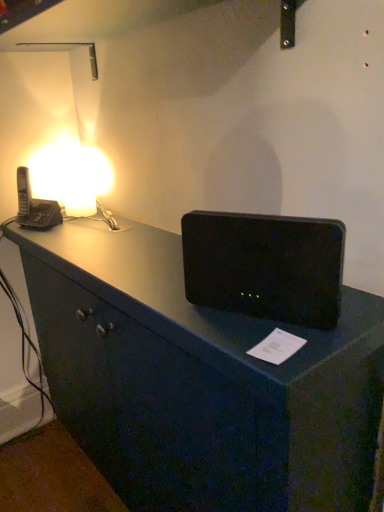
What do you see at coordinates (35, 206) in the screenshot?
I see `black plastic phone at left` at bounding box center [35, 206].

Where is `black plastic speaker at center`? The width and height of the screenshot is (384, 512). black plastic speaker at center is located at coordinates (265, 266).

What do you see at coordinates (265, 266) in the screenshot? The image size is (384, 512). I see `black plastic speaker at center` at bounding box center [265, 266].

What is the approximate width of matte white lamp at upper left?

The width of matte white lamp at upper left is 10.88 centimeters.

Locate an element on the screen. This screenshot has width=384, height=512. black plastic phone at left is located at coordinates (35, 206).

Which is more distant, (42, 200) or (340, 290)?

The point (42, 200) is farther.

Between black plastic phone at left and black plastic speaker at center, which one has more height?

With more height is black plastic phone at left.

Is black plastic phone at left completely or partially outside of black plastic speaker at center?

black plastic phone at left is positioned outside black plastic speaker at center.

What's the angular difference between black plastic speaker at center and matte white lamp at upper left's facing directions?

0.0121 degrees.

Could you tell me if black plastic speaker at center is facing matte white lamp at upper left?

No, black plastic speaker at center is not facing towards matte white lamp at upper left.

Considering the positions of point (201, 260) and point (60, 186), is point (201, 260) closer or farther from the camera than point (60, 186)?

Clearly, point (201, 260) is closer to the camera than point (60, 186).

Does matte white lamp at upper left have a lesser height compared to black plastic speaker at center?

In fact, matte white lamp at upper left may be taller than black plastic speaker at center.

Consider the image. How distant is matte white lamp at upper left from black plastic speaker at center?

A distance of 32.96 inches exists between matte white lamp at upper left and black plastic speaker at center.

Considering the sizes of objects matte white lamp at upper left and black plastic speaker at center in the image provided, who is smaller, matte white lamp at upper left or black plastic speaker at center?

matte white lamp at upper left.

Considering the positions of points (58, 170) and (29, 219), is point (58, 170) farther from camera compared to point (29, 219)?

That is True.

Is matte white lamp at upper left positioned behind black plastic phone at left?

Yes, matte white lamp at upper left is behind black plastic phone at left.

Measure the distance from matte white lamp at upper left to black plastic phone at left.

10.90 centimeters.

What are the coordinates of `lamp on the right of black plastic phone at left` in the screenshot? It's located at (71, 177).

Is black plastic phone at left completely or partially inside black plastic speaker at center?

No, black plastic speaker at center does not contain black plastic phone at left.

Is black plastic speaker at center positioned far away from black plastic phone at left?

black plastic speaker at center is actually quite close to black plastic phone at left.

Is black plastic speaker at center positioned with its back to black plastic phone at left?

No, black plastic speaker at center's orientation is not away from black plastic phone at left.

Considering the sizes of black plastic speaker at center and black plastic phone at left in the image, is black plastic speaker at center bigger or smaller than black plastic phone at left?

Considering their sizes, black plastic speaker at center takes up less space than black plastic phone at left.

Does black plastic phone at left have a lesser height compared to matte white lamp at upper left?

Yes.

Where is `lamp that is above the black plastic phone at left (from a real-world perspective)`? The width and height of the screenshot is (384, 512). lamp that is above the black plastic phone at left (from a real-world perspective) is located at coordinates (71, 177).

Looking at the image, does black plastic phone at left seem bigger or smaller compared to matte white lamp at upper left?

Clearly, black plastic phone at left is larger in size than matte white lamp at upper left.

Which is in front, point (51, 205) or point (73, 156)?

The point (51, 205) is more forward.

Where is `gadget on the left of black plastic speaker at center`? This screenshot has height=512, width=384. gadget on the left of black plastic speaker at center is located at coordinates (35, 206).

Identify the location of loudspeaker lying below the matte white lamp at upper left (from the image's perspective). (265, 266).

Based on their spatial positions, is black plastic phone at left or matte white lamp at upper left further from black plastic speaker at center?

matte white lamp at upper left is positioned further to the anchor black plastic speaker at center.

When comparing their distances from black plastic speaker at center, does matte white lamp at upper left or black plastic phone at left seem further?

matte white lamp at upper left is further to black plastic speaker at center.

Looking at the image, which one is located closer to black plastic phone at left, matte white lamp at upper left or black plastic speaker at center?

Among the two, matte white lamp at upper left is located nearer to black plastic phone at left.

Based on their spatial positions, is black plastic speaker at center or black plastic phone at left further from matte white lamp at upper left?

Among the two, black plastic speaker at center is located further to matte white lamp at upper left.

Which object lies nearer to the anchor point matte white lamp at upper left, black plastic phone at left or black plastic speaker at center?

The object closer to matte white lamp at upper left is black plastic phone at left.

Based on their spatial positions, is black plastic speaker at center or matte white lamp at upper left further from black plastic phone at left?

black plastic speaker at center is positioned further to the anchor black plastic phone at left.

This screenshot has width=384, height=512. I want to click on gadget between black plastic speaker at center and matte white lamp at upper left along the z-axis, so click(35, 206).